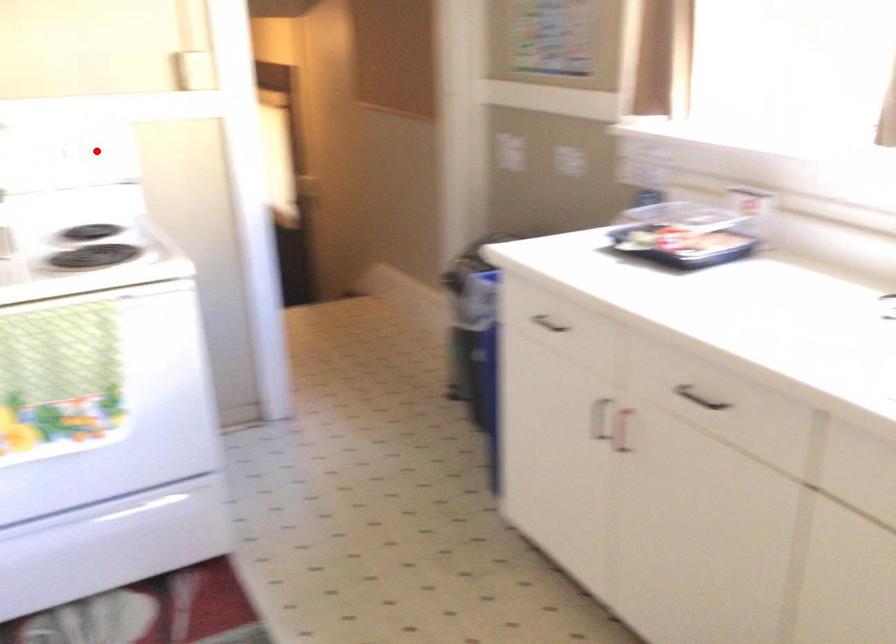
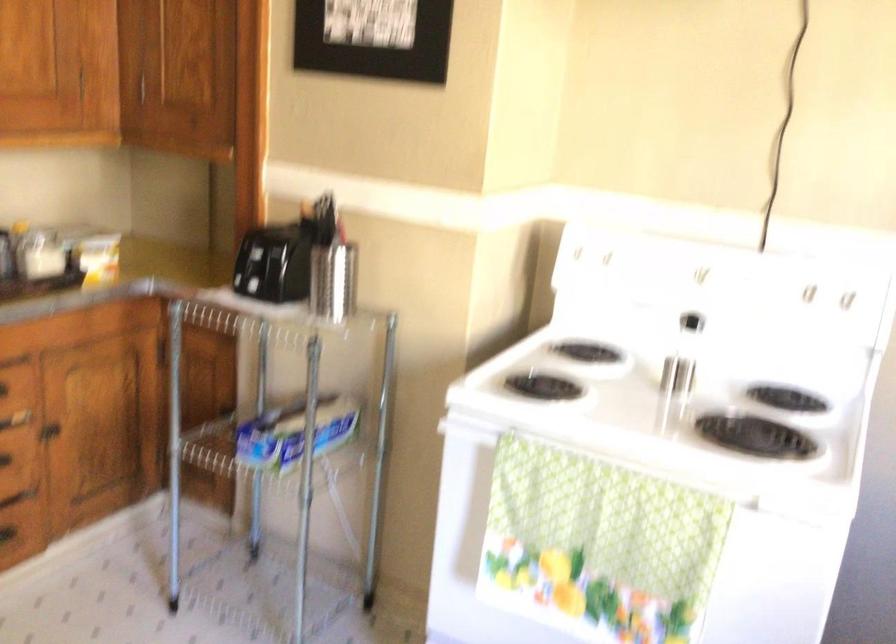
Question: I am providing you with two images of the same scene from different viewpoints. A red point is shown in image1. For the corresponding object point in image2, is it positioned nearer or farther from the camera?

Choices:
 (A) Nearer
 (B) Farther

Answer: (A)